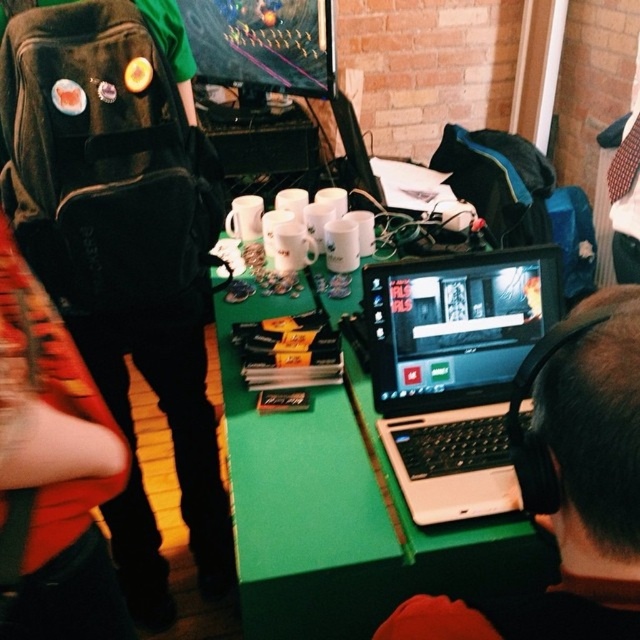
Question: Which of these objects is positioned closest to the black matte laptop at lower right?

Choices:
 (A) white plastic laptop at center
 (B) green matte table at center

Answer: (B)

Question: Does green matte table at center have a greater width compared to black matte laptop at lower right?

Choices:
 (A) yes
 (B) no

Answer: (A)

Question: Which object is farther from the camera taking this photo?

Choices:
 (A) black matte laptop at lower right
 (B) white plastic laptop at center
 (C) green matte table at center

Answer: (B)

Question: Which point is closer to the camera taking this photo?

Choices:
 (A) (481, 422)
 (B) (241, 596)

Answer: (B)

Question: Is green matte table at center closer to the viewer compared to black matte laptop at lower right?

Choices:
 (A) yes
 (B) no

Answer: (B)

Question: Does green matte table at center appear on the right side of white plastic laptop at center?

Choices:
 (A) yes
 (B) no

Answer: (B)